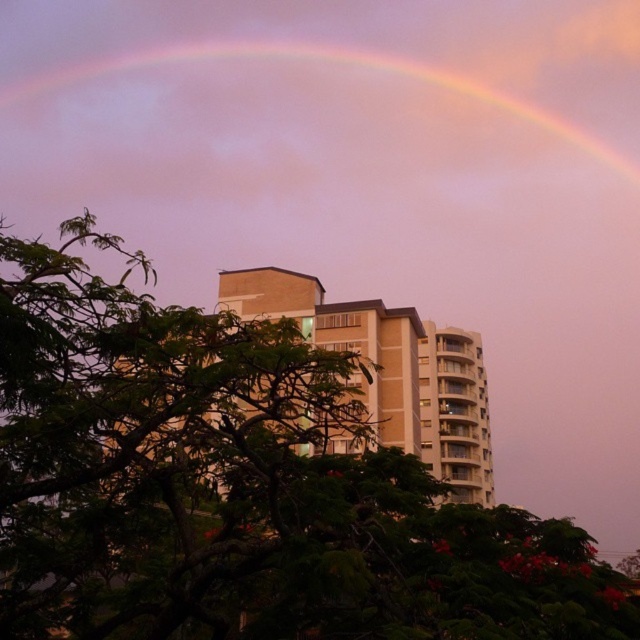
Between green leafy tree at center and rainbow at upper center, which one appears on the right side from the viewer's perspective?

green leafy tree at center is more to the right.

Is the position of green leafy tree at center less distant than that of rainbow at upper center?

Yes, green leafy tree at center is in front of rainbow at upper center.

Who is more distant from viewer, (x=131, y=371) or (x=173, y=60)?

The point (x=173, y=60) is more distant.

The width and height of the screenshot is (640, 640). What are the coordinates of `green leafy tree at center` in the screenshot? It's located at (237, 486).